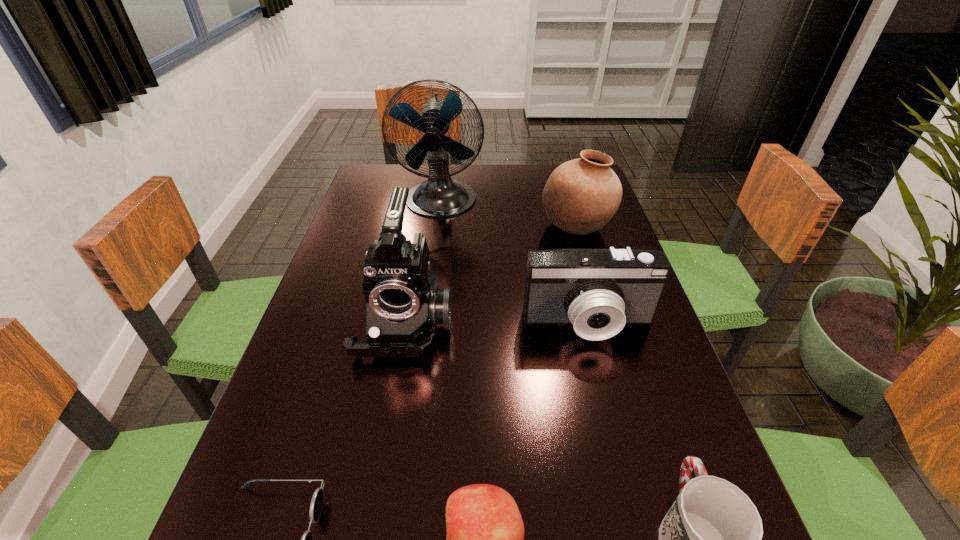
Locate an element on the screen. The image size is (960, 540). fan is located at coordinates (440, 196).

The image size is (960, 540). In order to click on the left camcorder in this screenshot , I will do `click(404, 308)`.

This screenshot has height=540, width=960. Identify the location of the sixth shortest object. pos(404,308).

The width and height of the screenshot is (960, 540). Identify the location of pottery. pos(580,197).

In order to click on the shorter camcorder in this screenshot , I will do `click(598, 291)`.

The width and height of the screenshot is (960, 540). I want to click on the fourth shortest object, so click(x=598, y=291).

Identify the location of blank space located on the front-facing side of the tallest object. The width and height of the screenshot is (960, 540). point(426,313).

Image resolution: width=960 pixels, height=540 pixels. I want to click on free point located 0.070m on the lens mount of the left camcorder, so click(393, 395).

At what (x,y) coordinates should I click in order to perform the action: click on blank area located 0.120m on the left of the pottery. Please return your answer as a coordinate pair (x, y). The height and width of the screenshot is (540, 960). Looking at the image, I should click on (496, 227).

The width and height of the screenshot is (960, 540). I want to click on free space located 0.210m on the lens of the shorter camcorder, so click(618, 443).